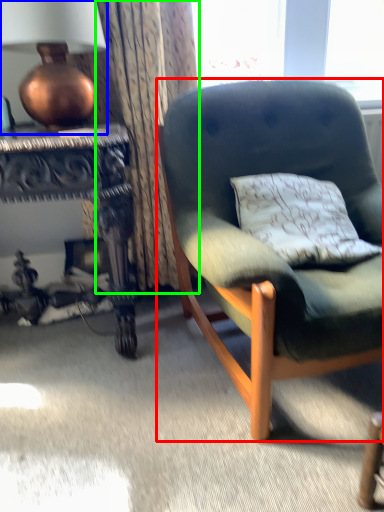
Question: Based on their relative distances, which object is farther from chair (highlighted by a red box)? Choose from lamp (highlighted by a blue box) and curtain (highlighted by a green box).

Choices:
 (A) lamp
 (B) curtain

Answer: (A)